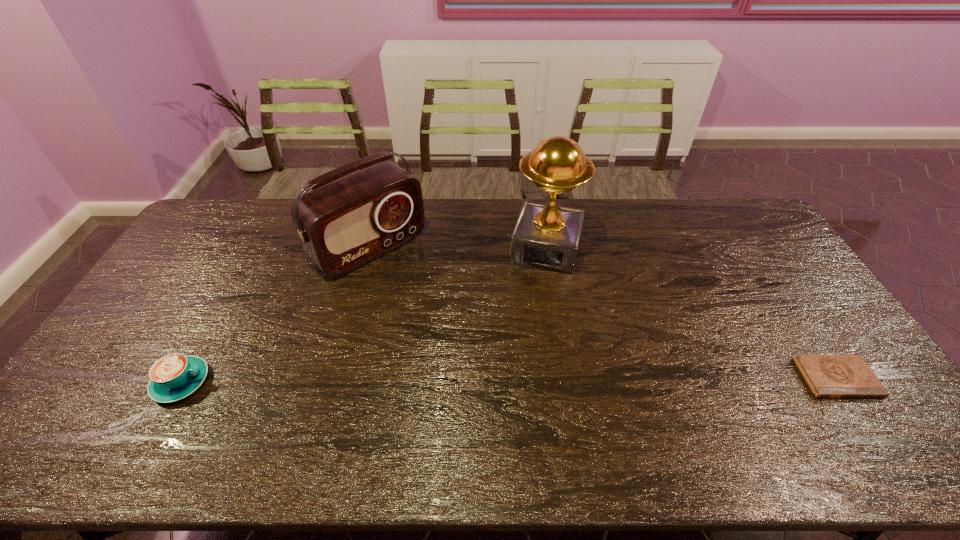
Where is `cappuccino`? The width and height of the screenshot is (960, 540). cappuccino is located at coordinates (175, 376).

Where is `the second shortest object`? The height and width of the screenshot is (540, 960). the second shortest object is located at coordinates (175, 376).

Find the location of `diary`. diary is located at coordinates [828, 376].

Locate an element on the screen. The width and height of the screenshot is (960, 540). the rightmost object is located at coordinates (828, 376).

Locate an element on the screen. the tallest object is located at coordinates (546, 236).

Find the location of a particular element. the third object from left to right is located at coordinates click(x=546, y=236).

Locate an element on the screen. Image resolution: width=960 pixels, height=540 pixels. radio receiver is located at coordinates (343, 224).

Where is `the second tallest object`? the second tallest object is located at coordinates (343, 224).

Image resolution: width=960 pixels, height=540 pixels. What are the coordinates of `vacant space situated with the handle on the right side of the cappuccino` in the screenshot? It's located at [284, 382].

You are a GUI agent. You are given a task and a screenshot of the screen. Output one action in this format:
    pyautogui.click(x=<x>, y=<y>)
    Task: Click on the vacant space located on the front-facing side of the tallest object
    This screenshot has height=540, width=960.
    Given the screenshot: What is the action you would take?
    pyautogui.click(x=516, y=363)